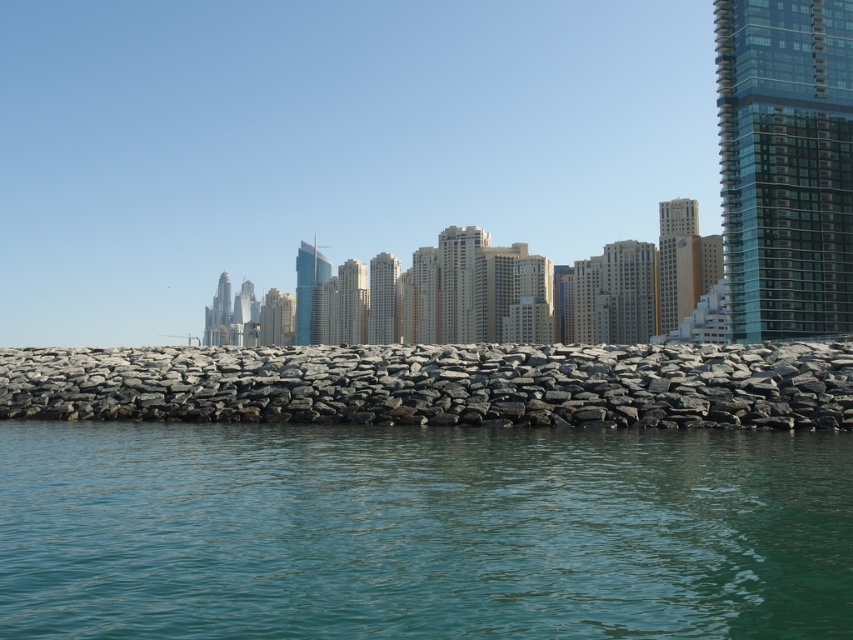
Question: Does clear water at center lie in front of gray rock wall at center?

Choices:
 (A) no
 (B) yes

Answer: (B)

Question: Where is clear water at center located in relation to gray rock wall at center in the image?

Choices:
 (A) above
 (B) below

Answer: (B)

Question: Can you confirm if clear water at center is positioned above gray rock wall at center?

Choices:
 (A) yes
 (B) no

Answer: (B)

Question: Which object is farther from the camera taking this photo?

Choices:
 (A) gray rock wall at center
 (B) clear water at center

Answer: (A)